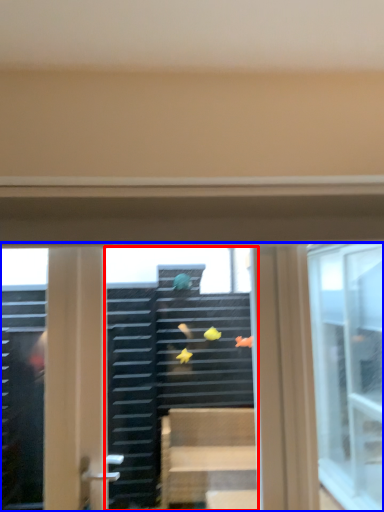
Question: Which object is closer to the camera taking this photo, shop window (highlighted by a red box) or window (highlighted by a blue box)?

Choices:
 (A) shop window
 (B) window

Answer: (B)